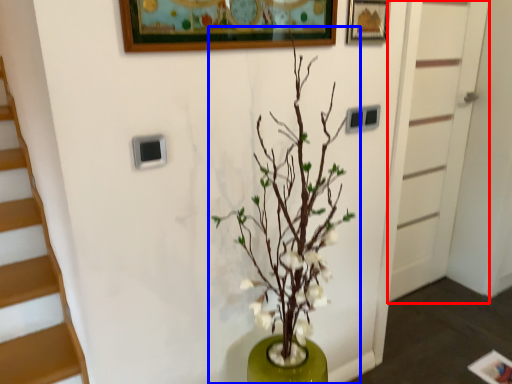
Question: Which object is further to the camera taking this photo, door (highlighted by a red box) or houseplant (highlighted by a blue box)?

Choices:
 (A) door
 (B) houseplant

Answer: (A)